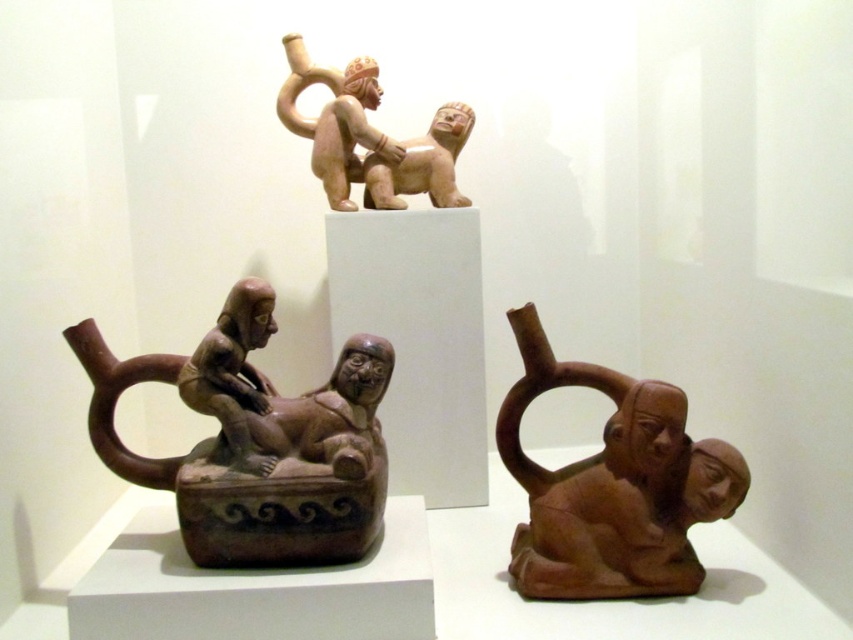
Does brown matte clay figure at center have a smaller size compared to matte beige figure at upper center?

Actually, brown matte clay figure at center might be larger than matte beige figure at upper center.

Who is shorter, brown matte clay figure at center or matte beige figure at upper center?

matte beige figure at upper center is shorter.

Where is `brown matte clay figure at center`? The image size is (853, 640). brown matte clay figure at center is located at coordinates (256, 442).

At what (x,y) coordinates should I click in order to perform the action: click on brown matte clay figure at center. Please return your answer as a coordinate pair (x, y). This screenshot has width=853, height=640. Looking at the image, I should click on tap(256, 442).

Is point (677, 410) farther from viewer compared to point (380, 208)?

No, it is not.

How far apart are brown clay figure at center and matte beige figure at upper center?

brown clay figure at center and matte beige figure at upper center are 95.24 centimeters apart.

Between point (543, 572) and point (317, 116), which one is positioned in front?

Point (543, 572) is more forward.

I want to click on brown clay figure at center, so click(x=612, y=484).

In the scene shown: Measure the distance from brown matte clay figure at center to brown clay figure at center.

brown matte clay figure at center is 24.13 inches from brown clay figure at center.

Describe the element at coordinates (256, 442) in the screenshot. Image resolution: width=853 pixels, height=640 pixels. I see `brown matte clay figure at center` at that location.

Locate an element on the screen. This screenshot has height=640, width=853. brown matte clay figure at center is located at coordinates (256, 442).